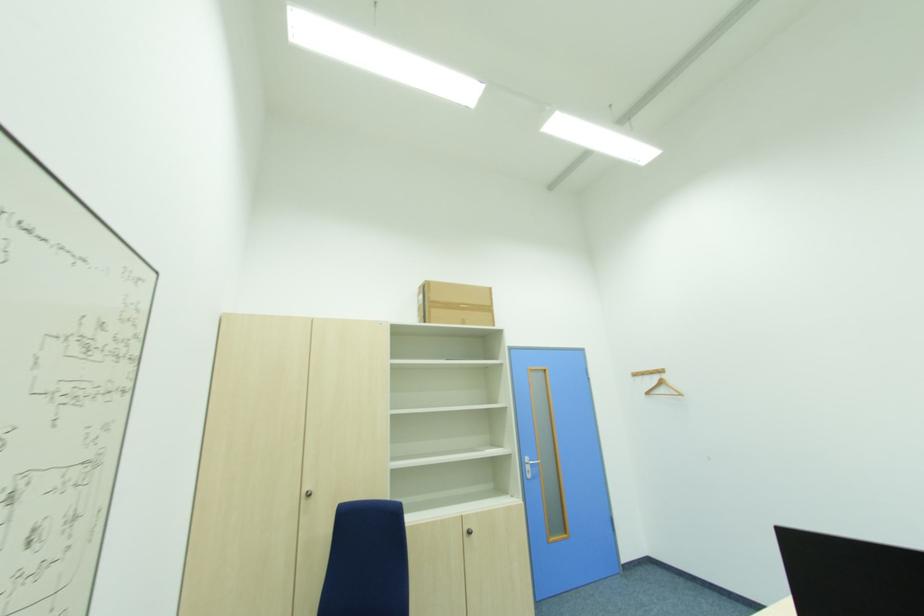
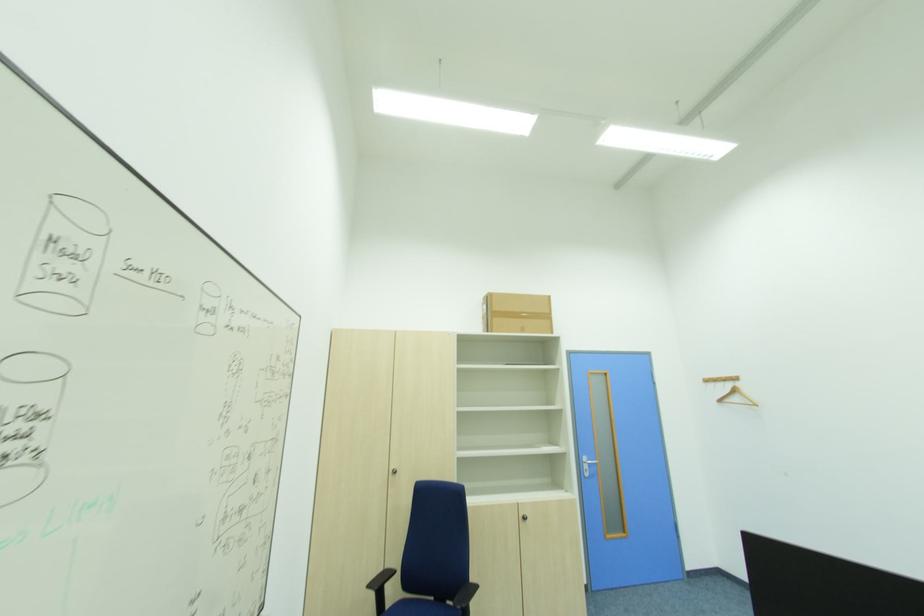
What movement of the cameraman would produce the second image?

The cameraman walked toward right, backward.